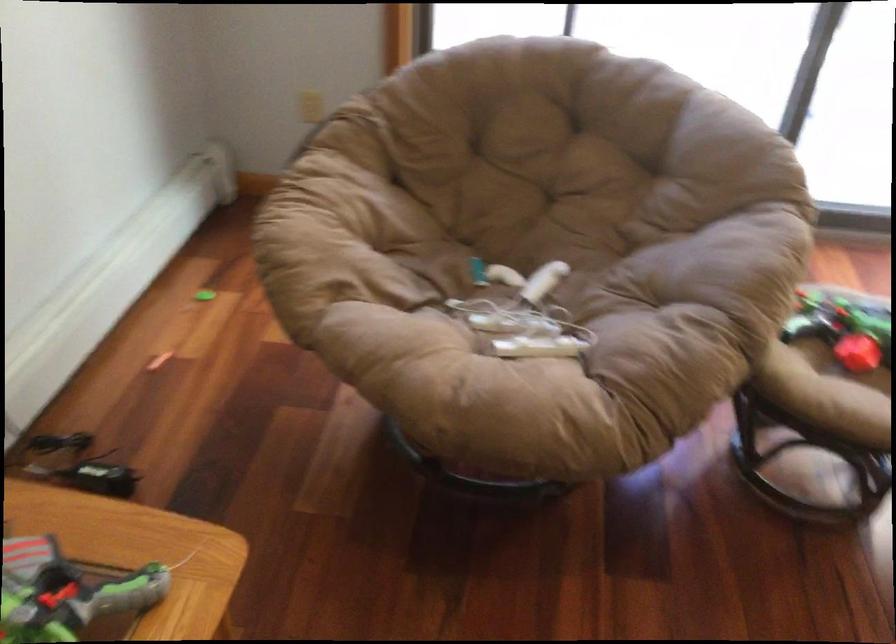
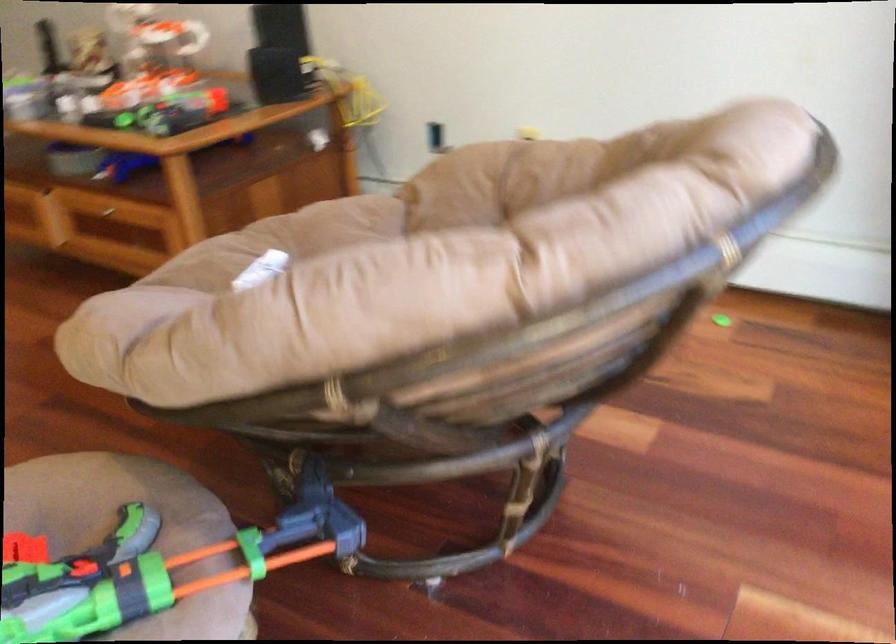
In the second image, find the point that corresponds to the point at 797,310 in the first image.

(133, 532)